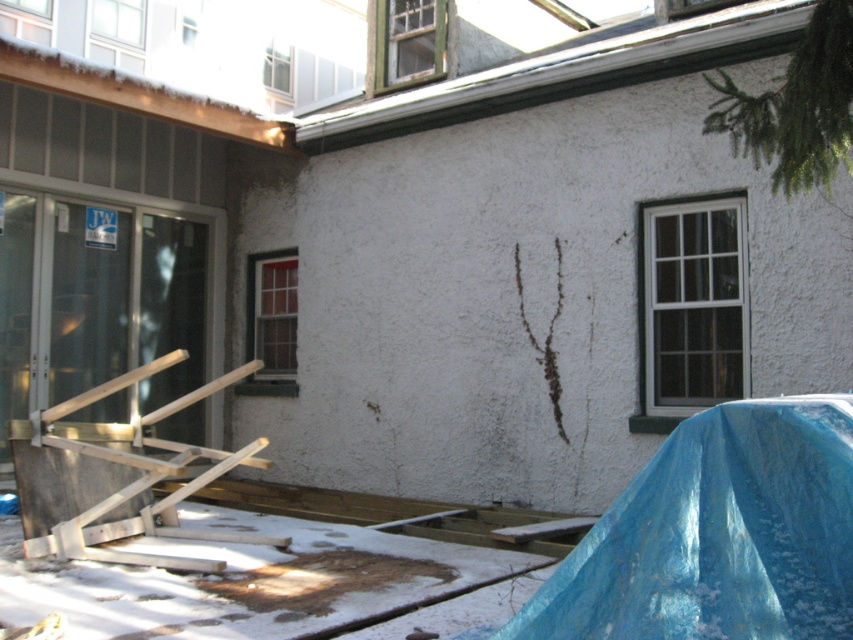
Which is behind, point (618, 634) or point (128, 330)?

The point (128, 330) is more distant.

Is blue plastic tarp at lower right to the left of clear glass screen door at left from the viewer's perspective?

Incorrect, blue plastic tarp at lower right is not on the left side of clear glass screen door at left.

The height and width of the screenshot is (640, 853). What are the coordinates of `blue plastic tarp at lower right` in the screenshot? It's located at (718, 534).

Where is `blue plastic tarp at lower right`? The image size is (853, 640). blue plastic tarp at lower right is located at coordinates (718, 534).